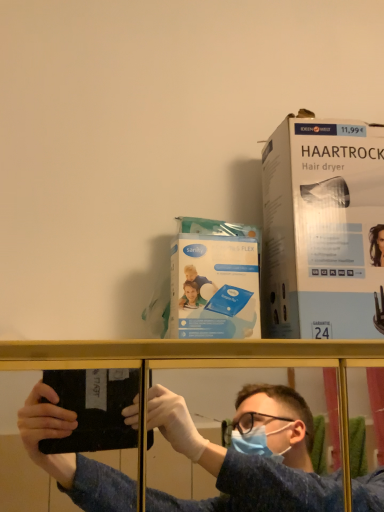
You are a GUI agent. You are given a task and a screenshot of the screen. Output one action in this format:
    pyautogui.click(x=<x>, y=<y>)
    Task: Click on the blue plastic sanitary pads at center, the first paperback book positioned from the left
    This screenshot has height=512, width=384.
    Given the screenshot: What is the action you would take?
    pyautogui.click(x=215, y=280)

Identify the location of blue fabric shirt at center. The width and height of the screenshot is (384, 512). (245, 459).

Find the location of `white cardboard box at upper right, marked as the first paperback book in a right-to-left arrangement`. white cardboard box at upper right, marked as the first paperback book in a right-to-left arrangement is located at coordinates (321, 229).

Is the surface of blue plastic sanitary pads at center, the first paperback book positioned from the left, in direct contact with white cardboard box at upper right, marked as the first paperback book in a right-to-left arrangement?

Absolutely, blue plastic sanitary pads at center, the first paperback book positioned from the left, is next to and touching white cardboard box at upper right, marked as the first paperback book in a right-to-left arrangement.

Who is more distant, blue plastic sanitary pads at center, the first paperback book positioned from the left, or white cardboard box at upper right, marked as the first paperback book in a right-to-left arrangement?

white cardboard box at upper right, marked as the first paperback book in a right-to-left arrangement, is further away from the camera.

Considering the sizes of objects blue plastic sanitary pads at center, the first paperback book positioned from the left, and white cardboard box at upper right, the 2th paperback book in the left-to-right sequence, in the image provided, who is smaller, blue plastic sanitary pads at center, the first paperback book positioned from the left, or white cardboard box at upper right, the 2th paperback book in the left-to-right sequence,?

blue plastic sanitary pads at center, the first paperback book positioned from the left.

Is white cardboard box at upper right, marked as the first paperback book in a right-to-left arrangement, placed right next to blue fabric shirt at center?

No, white cardboard box at upper right, marked as the first paperback book in a right-to-left arrangement, is not beside blue fabric shirt at center.

Looking at this image, who is bigger, white cardboard box at upper right, the 2th paperback book in the left-to-right sequence, or blue fabric shirt at center?

blue fabric shirt at center.

Is white cardboard box at upper right, marked as the first paperback book in a right-to-left arrangement, oriented towards blue fabric shirt at center?

No.

Which is less distant, [310,125] or [238,503]?

Clearly, point [310,125] is closer to the camera than point [238,503].

From the image's perspective, is white cardboard box at upper right, marked as the first paperback book in a right-to-left arrangement, above blue plastic sanitary pads at center, the first paperback book positioned from the left?

Yes, from the image's perspective, white cardboard box at upper right, marked as the first paperback book in a right-to-left arrangement, is over blue plastic sanitary pads at center, the first paperback book positioned from the left.

Which object is wider, white cardboard box at upper right, marked as the first paperback book in a right-to-left arrangement, or blue plastic sanitary pads at center, positioned as the 2th paperback book in right-to-left order?

white cardboard box at upper right, marked as the first paperback book in a right-to-left arrangement, is wider.

Who is smaller, white cardboard box at upper right, the 2th paperback book in the left-to-right sequence, or blue plastic sanitary pads at center, positioned as the 2th paperback book in right-to-left order?

blue plastic sanitary pads at center, positioned as the 2th paperback book in right-to-left order.

Is blue fabric shirt at center bigger or smaller than blue plastic sanitary pads at center, positioned as the 2th paperback book in right-to-left order?

Considering their sizes, blue fabric shirt at center takes up more space than blue plastic sanitary pads at center, positioned as the 2th paperback book in right-to-left order.

Is blue fabric shirt at center positioned far away from blue plastic sanitary pads at center, the first paperback book positioned from the left?

No, there isn't a large distance between blue fabric shirt at center and blue plastic sanitary pads at center, the first paperback book positioned from the left.

Is blue fabric shirt at center to the left or to the right of blue plastic sanitary pads at center, the first paperback book positioned from the left, in the image?

blue fabric shirt at center is to the left of blue plastic sanitary pads at center, the first paperback book positioned from the left.

Does point (176, 398) lie behind point (248, 306)?

Yes, point (176, 398) is farther from viewer.

Is point (187, 261) positioned before point (109, 468)?

Yes, it is in front of point (109, 468).

In the scene shown: Considering the sizes of objects blue plastic sanitary pads at center, the first paperback book positioned from the left, and blue fabric shirt at center in the image provided, who is thinner, blue plastic sanitary pads at center, the first paperback book positioned from the left, or blue fabric shirt at center?

blue plastic sanitary pads at center, the first paperback book positioned from the left.

Is blue plastic sanitary pads at center, the first paperback book positioned from the left, turned away from blue fabric shirt at center?

No, blue fabric shirt at center is not at the back of blue plastic sanitary pads at center, the first paperback book positioned from the left.

From the picture: Which object is closer to the camera taking this photo, blue fabric shirt at center or white cardboard box at upper right, marked as the first paperback book in a right-to-left arrangement?

blue fabric shirt at center is closer to the camera.

Is blue fabric shirt at center aimed at white cardboard box at upper right, the 2th paperback book in the left-to-right sequence?

No, blue fabric shirt at center is not aimed at white cardboard box at upper right, the 2th paperback book in the left-to-right sequence.

Looking at their sizes, would you say blue fabric shirt at center is wider or thinner than white cardboard box at upper right, marked as the first paperback book in a right-to-left arrangement?

Clearly, blue fabric shirt at center has more width compared to white cardboard box at upper right, marked as the first paperback book in a right-to-left arrangement.

At what (x,y) coordinates should I click in order to perform the action: click on paperback book that is on the right side of blue plastic sanitary pads at center, the first paperback book positioned from the left. Please return your answer as a coordinate pair (x, y). Looking at the image, I should click on (321, 229).

This screenshot has height=512, width=384. I want to click on person on the left of white cardboard box at upper right, the 2th paperback book in the left-to-right sequence, so point(245,459).

Looking at the image, which one is located further to blue fabric shirt at center, blue plastic sanitary pads at center, the first paperback book positioned from the left, or white cardboard box at upper right, the 2th paperback book in the left-to-right sequence?

The object further to blue fabric shirt at center is blue plastic sanitary pads at center, the first paperback book positioned from the left.

When comparing their distances from blue plastic sanitary pads at center, the first paperback book positioned from the left, does white cardboard box at upper right, marked as the first paperback book in a right-to-left arrangement, or blue fabric shirt at center seem closer?

white cardboard box at upper right, marked as the first paperback book in a right-to-left arrangement.

Looking at the image, which one is located closer to blue fabric shirt at center, white cardboard box at upper right, the 2th paperback book in the left-to-right sequence, or blue plastic sanitary pads at center, positioned as the 2th paperback book in right-to-left order?

white cardboard box at upper right, the 2th paperback book in the left-to-right sequence.

Based on their spatial positions, is blue fabric shirt at center or white cardboard box at upper right, the 2th paperback book in the left-to-right sequence, further from blue plastic sanitary pads at center, the first paperback book positioned from the left?

blue fabric shirt at center is further to blue plastic sanitary pads at center, the first paperback book positioned from the left.

Based on their spatial positions, is blue plastic sanitary pads at center, positioned as the 2th paperback book in right-to-left order, or blue fabric shirt at center closer to white cardboard box at upper right, marked as the first paperback book in a right-to-left arrangement?

blue plastic sanitary pads at center, positioned as the 2th paperback book in right-to-left order, lies closer to white cardboard box at upper right, marked as the first paperback book in a right-to-left arrangement, than the other object.

Looking at the image, which one is located closer to white cardboard box at upper right, the 2th paperback book in the left-to-right sequence, blue fabric shirt at center or blue plastic sanitary pads at center, the first paperback book positioned from the left?

Based on the image, blue plastic sanitary pads at center, the first paperback book positioned from the left, appears to be nearer to white cardboard box at upper right, the 2th paperback book in the left-to-right sequence.

The image size is (384, 512). I want to click on paperback book between white cardboard box at upper right, marked as the first paperback book in a right-to-left arrangement, and blue fabric shirt at center vertically, so click(215, 280).